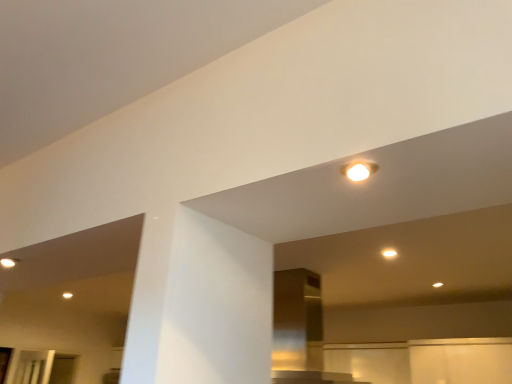
What do you see at coordinates (389, 253) in the screenshot?
I see `white glossy light at upper center` at bounding box center [389, 253].

Locate an element on the screen. white glossy light at upper center is located at coordinates (389, 253).

This screenshot has width=512, height=384. Find the location of `white glossy light at upper center`. white glossy light at upper center is located at coordinates (389, 253).